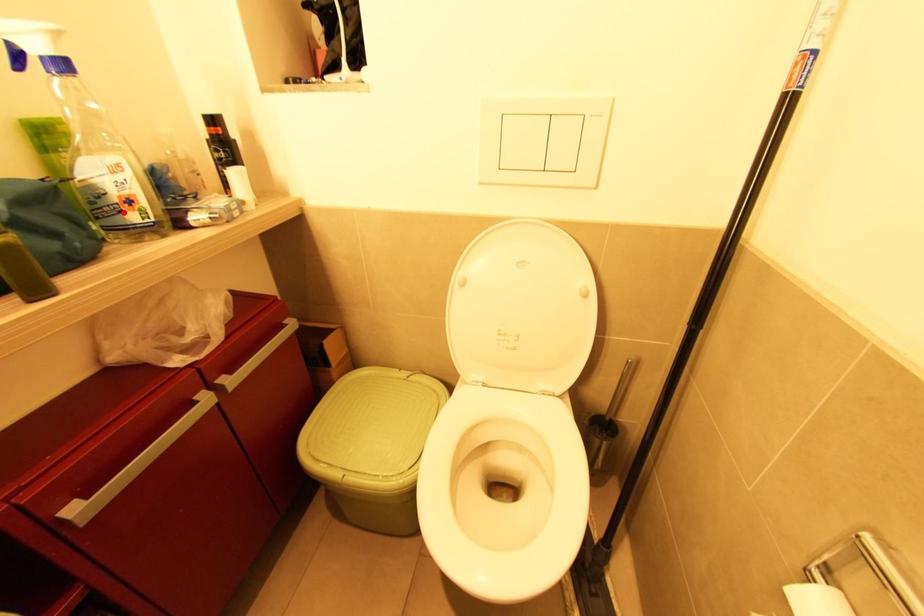
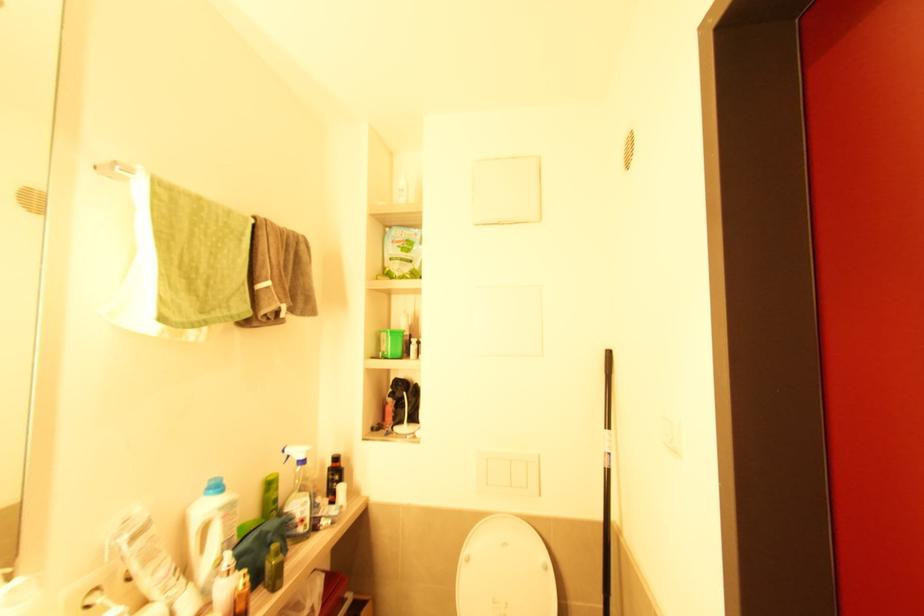
The point at the highlighted location is marked in the first image. Where is the corresponding point in the second image?

(298, 527)